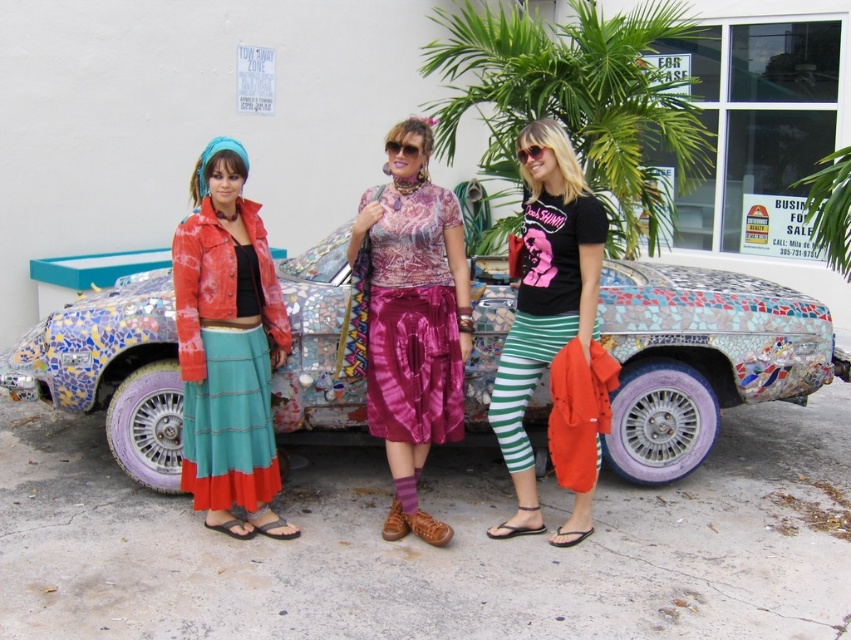
You are standing in front of the car and want to take a photo. There are two points on the car that you want to focus on. The first point is at coordinate point (404, 378) and the second is at point (523, 344). Which point should you focus on first to ensure it appears clearer in the photo?

Point (404, 378) is closer to the camera than point (523, 344), so focusing on point (404, 378) first will ensure it appears clearer in the photo.